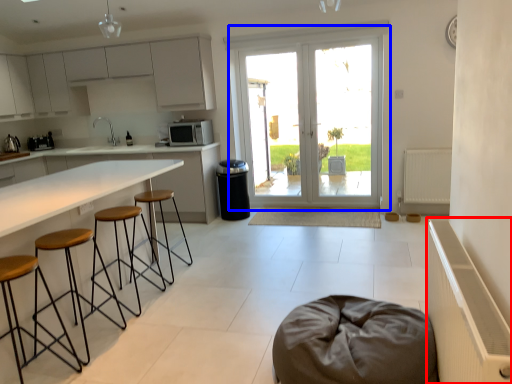
Question: Which object is further to the camera taking this photo, radiator (highlighted by a red box) or door (highlighted by a blue box)?

Choices:
 (A) radiator
 (B) door

Answer: (B)